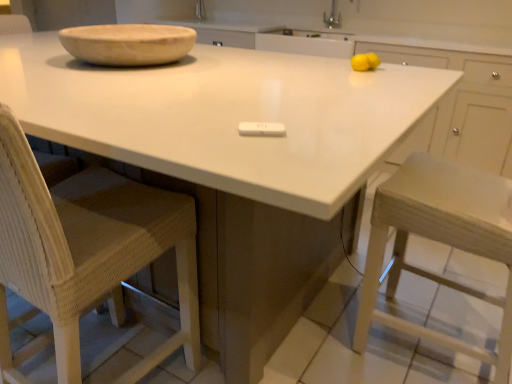
Question: Would you say wooden bowl at upper left contains woven wood chair at left?

Choices:
 (A) yes
 (B) no

Answer: (B)

Question: Is the position of wooden bowl at upper left more distant than that of woven wood chair at left?

Choices:
 (A) yes
 (B) no

Answer: (A)

Question: Considering the relative positions of wooden bowl at upper left and woven wood chair at left in the image provided, is wooden bowl at upper left to the left of woven wood chair at left from the viewer's perspective?

Choices:
 (A) yes
 (B) no

Answer: (A)

Question: Is wooden bowl at upper left wider than woven wood chair at left?

Choices:
 (A) yes
 (B) no

Answer: (A)

Question: Considering the relative sizes of wooden bowl at upper left and woven wood chair at left in the image provided, is wooden bowl at upper left taller than woven wood chair at left?

Choices:
 (A) no
 (B) yes

Answer: (A)

Question: Does point (4, 279) appear closer or farther from the camera than point (24, 46)?

Choices:
 (A) closer
 (B) farther

Answer: (A)

Question: Looking at their shapes, would you say woven wood chair at left is wider or thinner than white glossy countertop at center?

Choices:
 (A) thin
 (B) wide

Answer: (A)

Question: From the image's perspective, is woven wood chair at left positioned above or below white glossy countertop at center?

Choices:
 (A) above
 (B) below

Answer: (B)

Question: Based on their sizes in the image, would you say woven wood chair at left is bigger or smaller than white glossy countertop at center?

Choices:
 (A) small
 (B) big

Answer: (A)

Question: Based on their positions, is woven wood chair at left located to the left or right of wooden bowl at upper left?

Choices:
 (A) left
 (B) right

Answer: (B)

Question: Is point (12, 205) closer or farther from the camera than point (193, 34)?

Choices:
 (A) closer
 (B) farther

Answer: (A)

Question: Is woven wood chair at left inside the boundaries of wooden bowl at upper left, or outside?

Choices:
 (A) inside
 (B) outside

Answer: (B)

Question: From a real-world perspective, relative to wooden bowl at upper left, is woven wood chair at left vertically above or below?

Choices:
 (A) below
 (B) above

Answer: (A)

Question: From their relative heights in the image, would you say wooden bowl at upper left is taller or shorter than white glossy countertop at center?

Choices:
 (A) tall
 (B) short

Answer: (B)

Question: From the image's perspective, is wooden bowl at upper left positioned above or below white glossy countertop at center?

Choices:
 (A) above
 (B) below

Answer: (A)